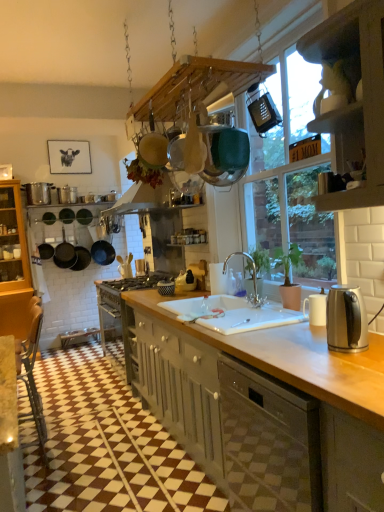
Find the location of `vacant area that is in front of clear glass faucet at center`. vacant area that is in front of clear glass faucet at center is located at coordinates (272, 310).